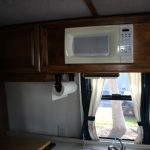
The image size is (150, 150). Identify the location of window. (117, 109), (115, 88).